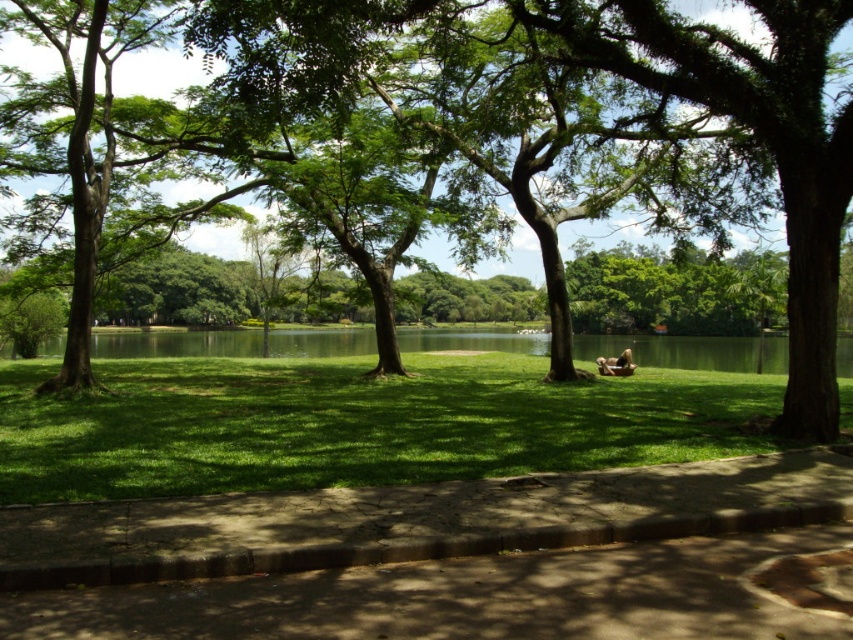
Question: Is green leafy tree at center above brown leather bag at center?

Choices:
 (A) no
 (B) yes

Answer: (B)

Question: Among these points, which one is nearest to the camera?

Choices:
 (A) (718, 65)
 (B) (631, 371)
 (C) (614, 464)
 (D) (469, 332)

Answer: (C)

Question: Which point is closer to the camera?

Choices:
 (A) [x=721, y=342]
 (B) [x=73, y=472]
 (C) [x=627, y=371]
 (D) [x=830, y=170]

Answer: (B)

Question: Based on their relative distances, which object is nearer to the green leafy tree at center?

Choices:
 (A) brown leather bag at center
 (B) green liquid water at center
 (C) green grass at center

Answer: (C)

Question: Can you confirm if green leafy tree at center is positioned below brown leather bag at center?

Choices:
 (A) no
 (B) yes

Answer: (A)

Question: Observing the image, what is the correct spatial positioning of green liquid water at center in reference to brown leather bag at center?

Choices:
 (A) right
 (B) left

Answer: (B)